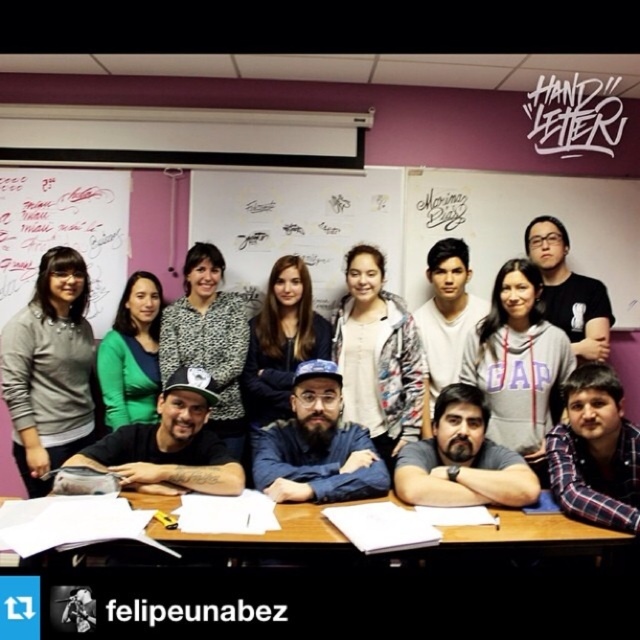
Between wooden table at center and gray fleece jacket at upper left, which one has less height?

wooden table at center is shorter.

What do you see at coordinates (355, 584) in the screenshot?
I see `wooden table at center` at bounding box center [355, 584].

This screenshot has height=640, width=640. What are the coordinates of `wooden table at center` in the screenshot? It's located at (355, 584).

Is the position of gray fleece jacket at upper left less distant than that of black text at center?

No, gray fleece jacket at upper left is behind black text at center.

Which is behind, point (61, 424) or point (208, 612)?

Positioned behind is point (61, 424).

Image resolution: width=640 pixels, height=640 pixels. Identify the location of gray fleece jacket at upper left. (49, 369).

In the scene shown: Can you confirm if whiteboard at center is bigger than gray fleece hoodie at center?

No.

Is point (220, 243) in front of point (516, 323)?

No.

The height and width of the screenshot is (640, 640). In order to click on whiteboard at center in this screenshot , I will do `click(298, 225)`.